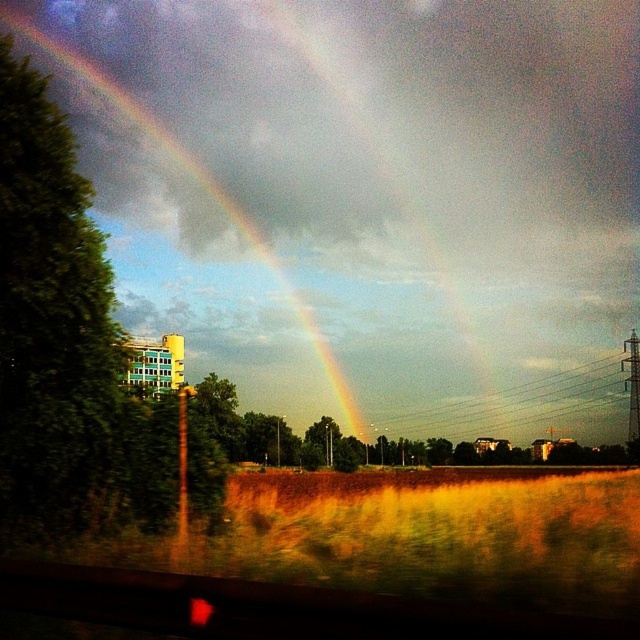
Question: Is rainbow at left bigger than metallic wire at center?

Choices:
 (A) yes
 (B) no

Answer: (A)

Question: In this image, where is rainbow at left located relative to metallic wire at center?

Choices:
 (A) left
 (B) right

Answer: (A)

Question: Which point is farther to the camera?

Choices:
 (A) (624, 390)
 (B) (115, 83)

Answer: (A)

Question: Considering the relative positions of rainbow at left and metallic wire at center in the image provided, where is rainbow at left located with respect to metallic wire at center?

Choices:
 (A) right
 (B) left

Answer: (B)

Question: Which point is farther from the camera taking this photo?

Choices:
 (A) (502, 392)
 (B) (180, 150)

Answer: (B)

Question: Among these points, which one is farthest from the camera?

Choices:
 (A) (252, 237)
 (B) (499, 396)

Answer: (B)